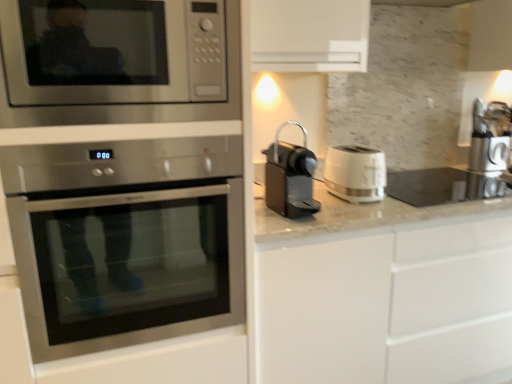
Question: Does stainless steel microwave at upper left appear on the right side of white marble countertop at right?

Choices:
 (A) no
 (B) yes

Answer: (A)

Question: Is stainless steel microwave at upper left taller than white marble countertop at right?

Choices:
 (A) no
 (B) yes

Answer: (B)

Question: Can you see stainless steel microwave at upper left touching white marble countertop at right?

Choices:
 (A) no
 (B) yes

Answer: (A)

Question: Does stainless steel microwave at upper left have a larger size compared to white marble countertop at right?

Choices:
 (A) no
 (B) yes

Answer: (B)

Question: Considering the relative positions of stainless steel microwave at upper left and white marble countertop at right in the image provided, is stainless steel microwave at upper left to the left of white marble countertop at right from the viewer's perspective?

Choices:
 (A) no
 (B) yes

Answer: (B)

Question: Does stainless steel microwave at upper left come behind white marble countertop at right?

Choices:
 (A) yes
 (B) no

Answer: (B)

Question: Is the depth of white plastic toaster at right less than that of white glossy cabinet at center?

Choices:
 (A) no
 (B) yes

Answer: (A)

Question: Does white plastic toaster at right appear on the left side of white glossy cabinet at center?

Choices:
 (A) no
 (B) yes

Answer: (B)

Question: From the image's perspective, would you say white plastic toaster at right is shown under white glossy cabinet at center?

Choices:
 (A) yes
 (B) no

Answer: (B)

Question: Is white plastic toaster at right not inside white glossy cabinet at center?

Choices:
 (A) yes
 (B) no

Answer: (A)

Question: Is white plastic toaster at right wider than white glossy cabinet at center?

Choices:
 (A) yes
 (B) no

Answer: (B)

Question: Is the position of white plastic toaster at right more distant than that of white glossy cabinet at center?

Choices:
 (A) yes
 (B) no

Answer: (A)

Question: Is black plastic coffee machine at center, which ranks as the first coffee machine in left-to-right order, shorter than white plastic toaster at right?

Choices:
 (A) yes
 (B) no

Answer: (B)